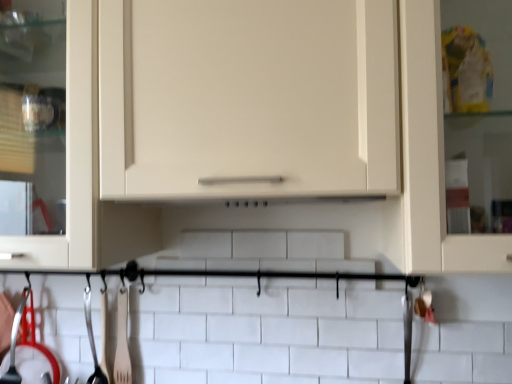
Question: Considering the relative sizes of polished metal spatula at lower left, positioned as the 3th silverware in left-to-right order, and polished metal ladle at lower left, the 1th silverware from the left, in the image provided, is polished metal spatula at lower left, positioned as the 3th silverware in left-to-right order, taller than polished metal ladle at lower left, the 1th silverware from the left,?

Choices:
 (A) no
 (B) yes

Answer: (B)

Question: Is polished metal spatula at lower left, positioned as the 3th silverware in left-to-right order, surrounding polished metal ladle at lower left, the 1th silverware from the left?

Choices:
 (A) no
 (B) yes

Answer: (A)

Question: Can you confirm if polished metal spatula at lower left, positioned as the 3th silverware in left-to-right order, is shorter than polished metal ladle at lower left, the 1th silverware from the left?

Choices:
 (A) yes
 (B) no

Answer: (B)

Question: Is polished metal spatula at lower left, which is counted as the 2th silverware, starting from the right, positioned in front of polished metal ladle at lower left, positioned as the fourth silverware in right-to-left order?

Choices:
 (A) yes
 (B) no

Answer: (A)

Question: Is the depth of polished metal spatula at lower left, positioned as the 3th silverware in left-to-right order, greater than that of polished metal ladle at lower left, the 1th silverware from the left?

Choices:
 (A) yes
 (B) no

Answer: (B)

Question: Does point (365, 33) appear closer or farther from the camera than point (93, 377)?

Choices:
 (A) farther
 (B) closer

Answer: (B)

Question: From a real-world perspective, is matte white cabinet at center physically located above or below polished metal spatula at lower left, which is counted as the 2th silverware, starting from the right?

Choices:
 (A) below
 (B) above

Answer: (B)

Question: Relative to polished metal spatula at lower left, positioned as the 3th silverware in left-to-right order, is matte white cabinet at center in front or behind?

Choices:
 (A) front
 (B) behind

Answer: (A)

Question: Considering the positions of matte white cabinet at center and polished metal spatula at lower left, which is counted as the 2th silverware, starting from the right, in the image, is matte white cabinet at center bigger or smaller than polished metal spatula at lower left, which is counted as the 2th silverware, starting from the right,?

Choices:
 (A) small
 (B) big

Answer: (B)

Question: Does point (24, 294) appear closer or farther from the camera than point (84, 317)?

Choices:
 (A) farther
 (B) closer

Answer: (A)

Question: From a real-world perspective, is polished metal ladle at lower left, positioned as the fourth silverware in right-to-left order, physically located above or below polished metal spatula at lower left, which is counted as the 2th silverware, starting from the right?

Choices:
 (A) above
 (B) below

Answer: (A)

Question: From the image's perspective, relative to polished metal spatula at lower left, which is counted as the 2th silverware, starting from the right, is polished metal ladle at lower left, the 1th silverware from the left, above or below?

Choices:
 (A) above
 (B) below

Answer: (A)

Question: Considering the positions of polished metal ladle at lower left, positioned as the fourth silverware in right-to-left order, and polished metal spatula at lower left, positioned as the 3th silverware in left-to-right order, in the image, is polished metal ladle at lower left, positioned as the fourth silverware in right-to-left order, taller or shorter than polished metal spatula at lower left, positioned as the 3th silverware in left-to-right order,?

Choices:
 (A) short
 (B) tall

Answer: (A)

Question: In terms of width, does wooden fork at lower left, which appears as the first silverware when viewed from the right, look wider or thinner when compared to shiny metallic spoon at lower left, which is counted as the 2th silverware, starting from the left?

Choices:
 (A) wide
 (B) thin

Answer: (B)

Question: From their relative heights in the image, would you say wooden fork at lower left, the 4th silverware when ordered from left to right, is taller or shorter than shiny metallic spoon at lower left, which is counted as the 3th silverware, starting from the right?

Choices:
 (A) short
 (B) tall

Answer: (B)